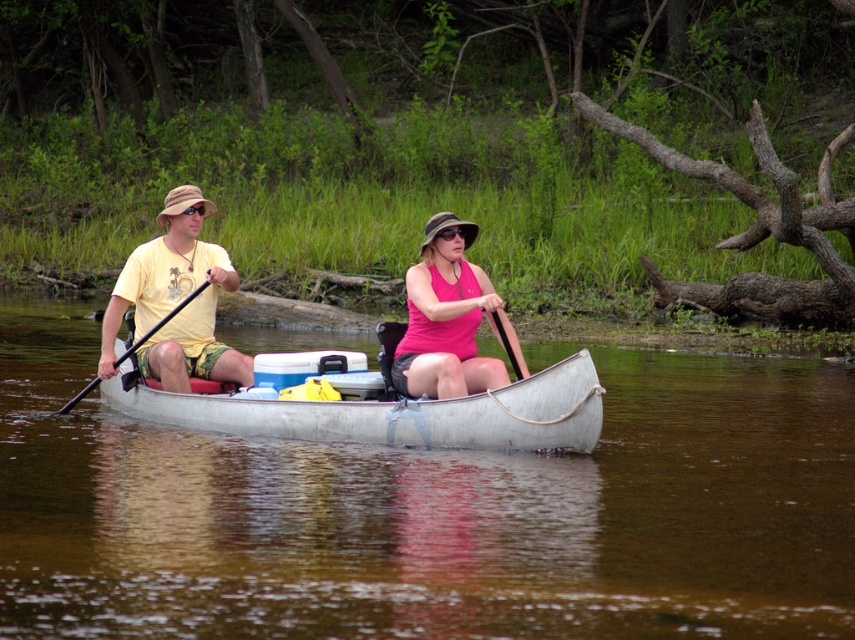
Question: From the image, what is the correct spatial relationship of white matte canoe at center in relation to matte yellow t-shirt at left?

Choices:
 (A) left
 (B) right

Answer: (B)

Question: Which point is farther to the camera?

Choices:
 (A) (423, 336)
 (B) (192, 237)
 (C) (161, 406)

Answer: (B)

Question: Among these points, which one is nearest to the camera?

Choices:
 (A) (703, 468)
 (B) (397, 387)
 (C) (161, 260)
 (D) (541, 371)

Answer: (D)

Question: Where is matte yellow t-shirt at center located in relation to matte yellow t-shirt at left in the image?

Choices:
 (A) below
 (B) above

Answer: (B)

Question: Is clear water at center positioned before black plastic paddle at left?

Choices:
 (A) no
 (B) yes

Answer: (B)

Question: Estimate the real-world distances between objects in this image. Which object is closer to the pink fabric tank top at center?

Choices:
 (A) matte yellow t-shirt at left
 (B) matte yellow t-shirt at center
 (C) white matte canoe at center

Answer: (C)